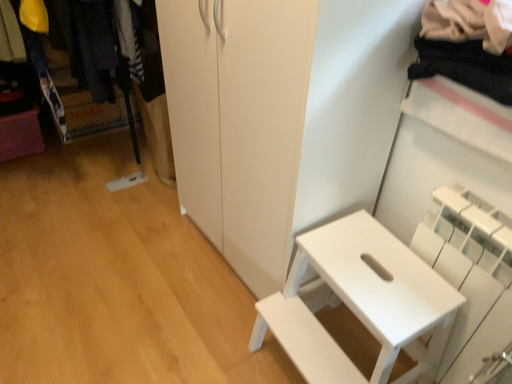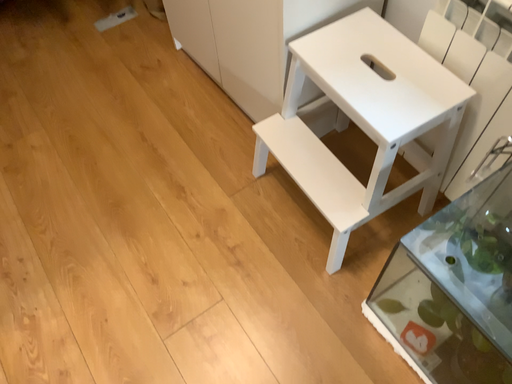
Question: Which way did the camera rotate in the video?

Choices:
 (A) rotated downward
 (B) rotated upward

Answer: (A)